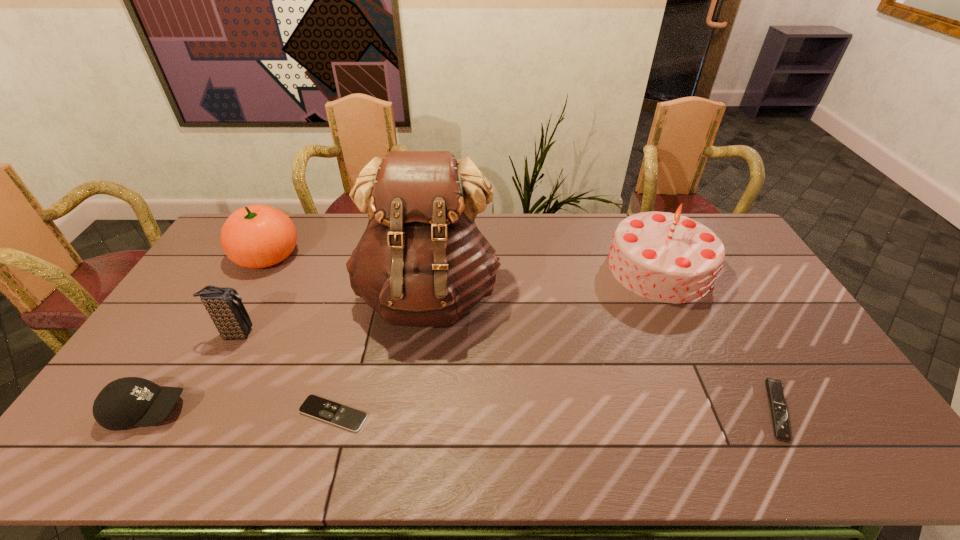
This screenshot has height=540, width=960. Identify the location of baseball cap at the left edge. (131, 401).

You are a GUI agent. You are given a task and a screenshot of the screen. Output one action in this format:
    pyautogui.click(x=<x>, y=<y>)
    Task: Click on the birthday cake present at the right edge
    The image size is (960, 540).
    Given the screenshot: What is the action you would take?
    pyautogui.click(x=666, y=257)

Identify the location of remote control located in the right edge section of the desktop. (781, 427).

Where is `object present at the far left corner`? The image size is (960, 540). object present at the far left corner is located at coordinates (256, 236).

The height and width of the screenshot is (540, 960). Find the location of `object at the near left corner`. object at the near left corner is located at coordinates (131, 401).

In order to click on object present at the far right corner in this screenshot , I will do `click(666, 257)`.

Find the location of a particular element. Image resolution: width=960 pixels, height=540 pixels. object that is at the near right corner is located at coordinates (781, 427).

Where is `free space at the far edge of the desktop`? free space at the far edge of the desktop is located at coordinates (587, 245).

This screenshot has width=960, height=540. I want to click on free space at the near edge of the desktop, so click(x=505, y=436).

Where is `vacant area that lies between the shorter remote control and the tallest object`? This screenshot has width=960, height=540. vacant area that lies between the shorter remote control and the tallest object is located at coordinates (380, 355).